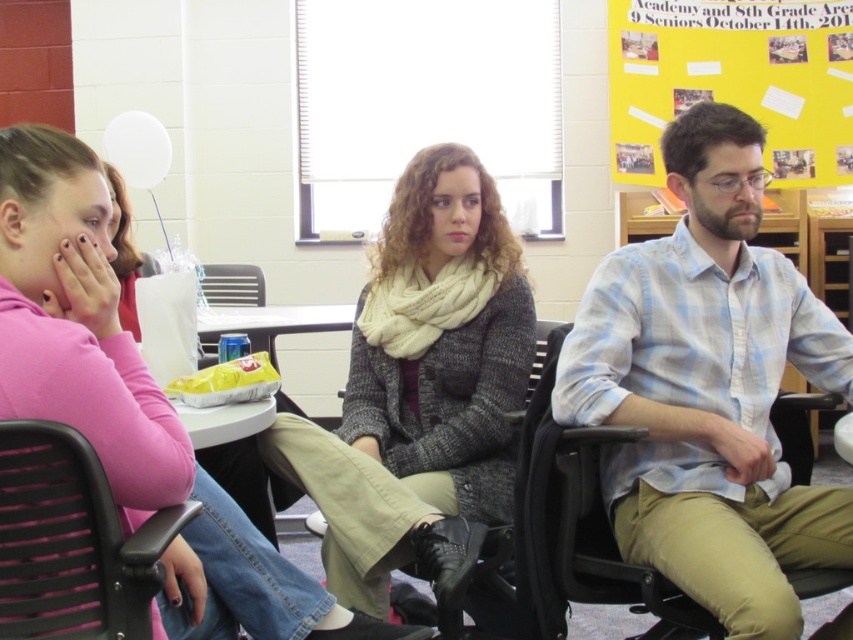
Between black plastic swivel chair at lower left and white plastic table at center, which one is positioned lower?

black plastic swivel chair at lower left is below.

Can you confirm if black plastic swivel chair at lower left is bigger than white plastic table at center?

Actually, black plastic swivel chair at lower left might be smaller than white plastic table at center.

Is point (86, 461) closer to viewer compared to point (258, 508)?

Yes, it is in front of point (258, 508).

The width and height of the screenshot is (853, 640). I want to click on black plastic swivel chair at lower left, so (71, 541).

Is knitted cream scarf at center bigger than black plastic swivel chair at lower left?

Yes.

Does point (450, 493) come closer to viewer compared to point (61, 564)?

No, it is not.

At what (x,y) coordinates should I click in order to perform the action: click on knitted cream scarf at center. Please return your answer as a coordinate pair (x, y). Looking at the image, I should click on (422, 392).

Locate an element on the screen. This screenshot has width=853, height=640. knitted cream scarf at center is located at coordinates [422, 392].

Can you confirm if knitted cream scarf at center is positioned to the left of white plastic table at center?

Incorrect, knitted cream scarf at center is not on the left side of white plastic table at center.

From the picture: Can you confirm if knitted cream scarf at center is shorter than white plastic table at center?

No.

Does point (506, 291) come farther from viewer compared to point (200, 323)?

That is False.

Locate an element on the screen. knitted cream scarf at center is located at coordinates (422, 392).